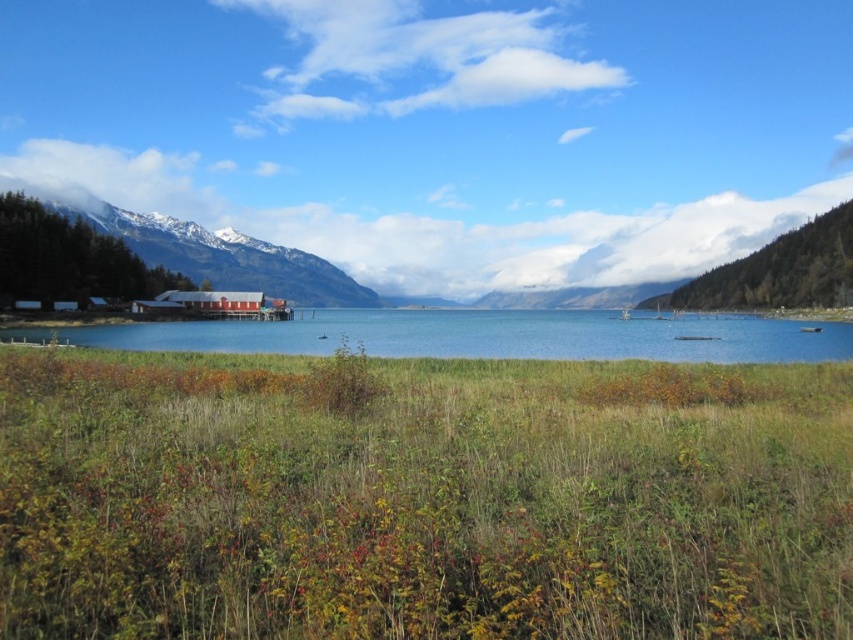
Question: Which object appears closest to the camera in this image?

Choices:
 (A) snowy mountain at left
 (B) blue water at center

Answer: (B)

Question: Which point appears farthest from the camera in this image?

Choices:
 (A) (787, 360)
 (B) (136, 244)

Answer: (B)

Question: Does blue water at center have a larger size compared to snowy mountain at left?

Choices:
 (A) yes
 (B) no

Answer: (B)

Question: Does blue water at center lie in front of snowy mountain at left?

Choices:
 (A) no
 (B) yes

Answer: (B)

Question: Among these points, which one is nearest to the camera?

Choices:
 (A) (334, 269)
 (B) (148, 342)

Answer: (B)

Question: Is blue water at center above snowy mountain at left?

Choices:
 (A) yes
 (B) no

Answer: (B)